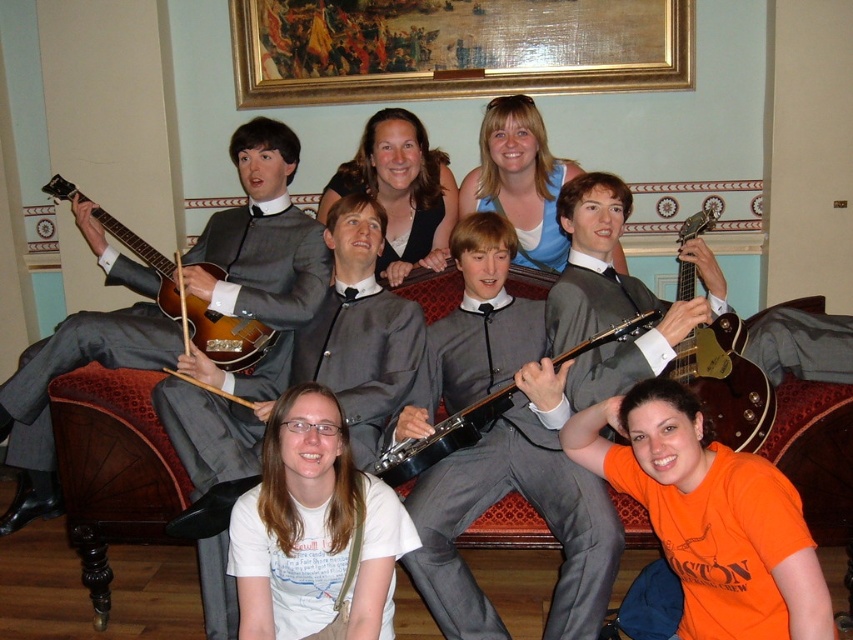
Between shiny silver guitar at left and matte gray suit at center, which one has more height?

shiny silver guitar at left

Where is `shiny silver guitar at left`? The height and width of the screenshot is (640, 853). shiny silver guitar at left is located at coordinates (260, 237).

Locate an element on the screen. The image size is (853, 640). shiny silver guitar at left is located at coordinates (260, 237).

Identify the location of shiny silver guitar at left. Image resolution: width=853 pixels, height=640 pixels. (260, 237).

Image resolution: width=853 pixels, height=640 pixels. I want to click on shiny silver guitar at left, so click(260, 237).

Does matte blue tank top at upper center have a larger size compared to glossy wood guitar at upper right?

Incorrect, matte blue tank top at upper center is not larger than glossy wood guitar at upper right.

Measure the distance between matte blue tank top at upper center and camera.

matte blue tank top at upper center is 3.17 meters away from camera.

Identify the location of matte blue tank top at upper center. (519, 179).